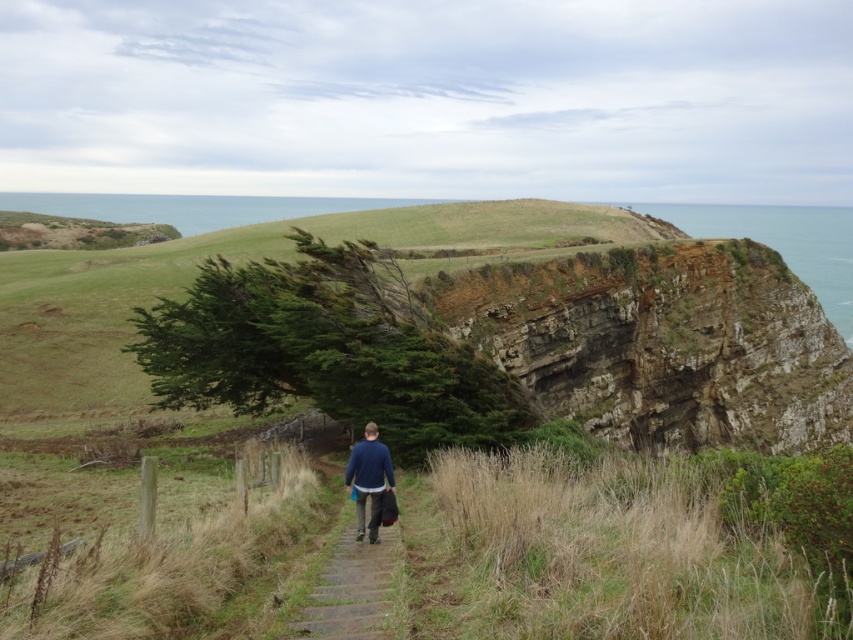
You are standing at point (x=306, y=625) and want to walk to the cliff face on the right side. Is the point (x=592, y=205) located behind you or in front of you relative to your walking direction?

The point (x=592, y=205) is behind point (x=306, y=625), so it is behind you relative to your walking direction towards the cliff face on the right side.

You are standing at the bottom of the stone steps leading up to the rugged stone cliff at upper right. If you want to reach the cliff, which direction should you head towards?

The rugged stone cliff at upper right is located at point (662, 342), so you should head towards the upper right direction to reach it.

You are standing at the base of the cliff and want to take a photo of the green grassy hillside at center and the brown wooden path at center. Which object should you focus on first to ensure it appears sharp in the foreground?

You should focus on the green grassy hillside at center first because it is in front of the brown wooden path at center, making it closer to the camera.